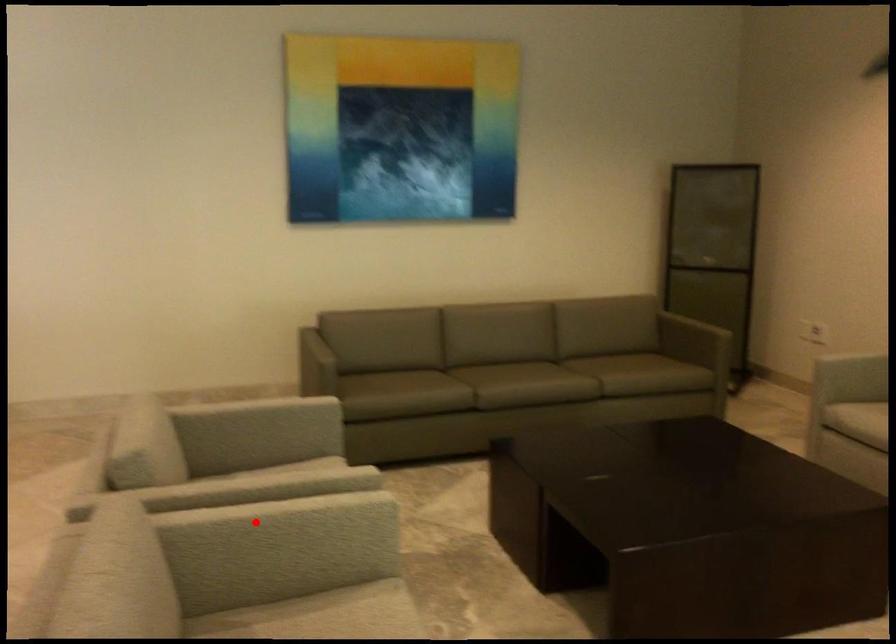
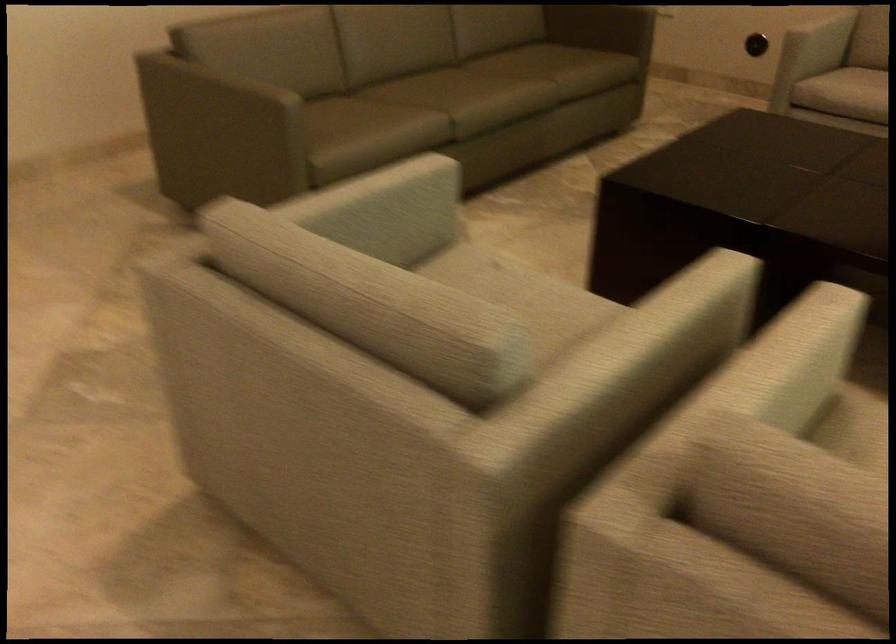
In the second image, find the point that corresponds to the highlighted location in the first image.

(782, 366)